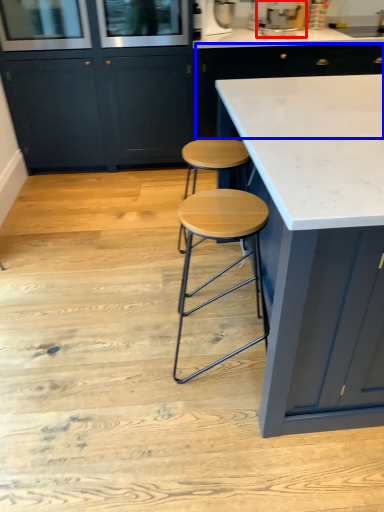
Question: Which object appears closest to the camera in this image, appliance (highlighted by a red box) or cabinetry (highlighted by a blue box)?

Choices:
 (A) appliance
 (B) cabinetry

Answer: (A)